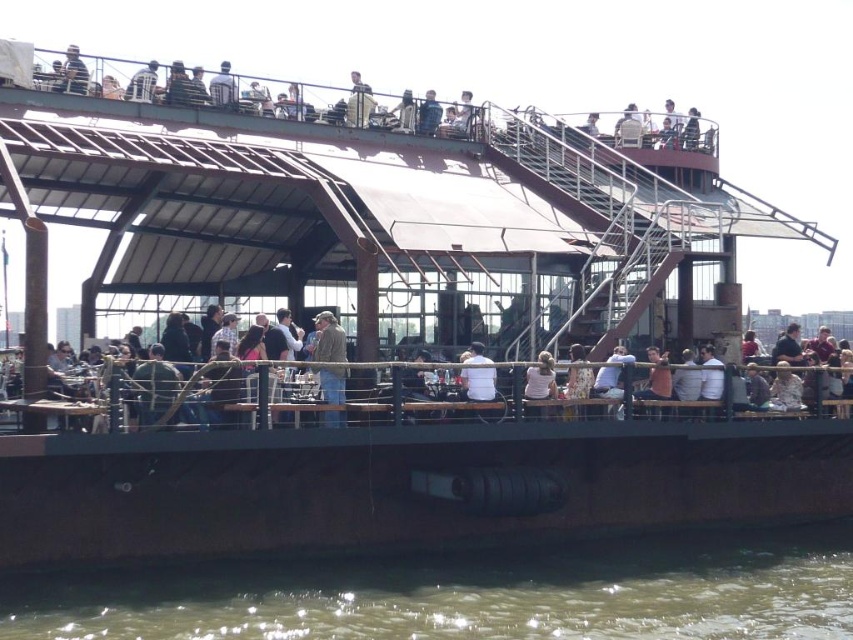
You are a guest at this waterfront venue and want to sit down. You see the light brown wooden chair at lower center and the blue denim jacket at upper center. Which object is larger in size?

The light brown wooden chair at lower center is bigger than the blue denim jacket at upper center.

You are a photographer trying to capture both the white cotton shirt at center and the metallic silver jacket at upper center in a single shot. Given their sizes and positions, which one will appear larger in the photo?

The metallic silver jacket at upper center will appear larger in the photo because it is larger than the white cotton shirt at center.

You are navigating a small boat approaching the waterfront structure. You notice two points marked on your map corresponding to coordinates point (213, 99) and point (432, 125). Which point should you aim for if you want to dock closer to the upper level where people are seated at tables?

Point (213, 99) is in front of point (432, 125), so you should aim for point (213, 99) to dock closer to the upper level where people are seated at tables.